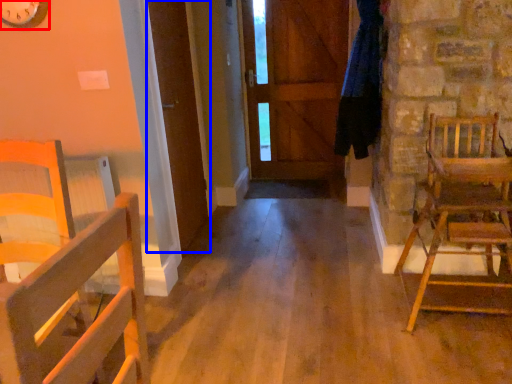
Question: Which point is further to the camera, clock (highlighted by a red box) or door (highlighted by a blue box)?

Choices:
 (A) clock
 (B) door

Answer: (B)